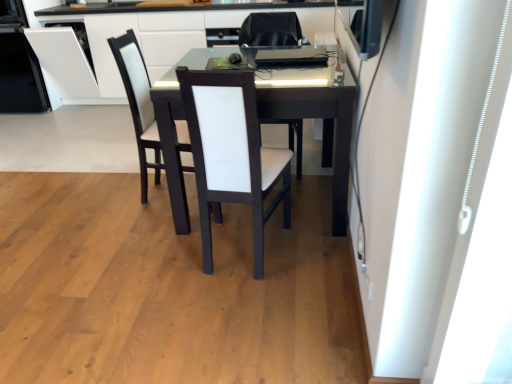
Question: Is white leather chair at center, acting as the second chair starting from the back, positioned far away from white leather chair at center?

Choices:
 (A) no
 (B) yes

Answer: (A)

Question: From the image's perspective, is white leather chair at center, acting as the second chair starting from the back, located above white leather chair at center?

Choices:
 (A) no
 (B) yes

Answer: (A)

Question: Is white leather chair at center, acting as the second chair starting from the back, outside of white leather chair at center?

Choices:
 (A) yes
 (B) no

Answer: (A)

Question: Does white leather chair at center, the first chair in the front-to-back sequence, lie in front of white leather chair at center?

Choices:
 (A) yes
 (B) no

Answer: (A)

Question: Does white leather chair at center, the first chair in the front-to-back sequence, have a lesser width compared to white leather chair at center?

Choices:
 (A) yes
 (B) no

Answer: (B)

Question: From their relative heights in the image, would you say white glossy dishwasher at left is taller or shorter than white leather chair at center, acting as the second chair starting from the back?

Choices:
 (A) short
 (B) tall

Answer: (B)

Question: From the image's perspective, is white glossy dishwasher at left positioned above or below white leather chair at center, the first chair in the front-to-back sequence?

Choices:
 (A) above
 (B) below

Answer: (A)

Question: Is white glossy dishwasher at left bigger or smaller than white leather chair at center, the first chair in the front-to-back sequence?

Choices:
 (A) small
 (B) big

Answer: (B)

Question: In the image, is white glossy dishwasher at left positioned in front of or behind white leather chair at center, acting as the second chair starting from the back?

Choices:
 (A) behind
 (B) front

Answer: (A)

Question: From a real-world perspective, is matte black desk at center positioned above or below white leather chair at center?

Choices:
 (A) above
 (B) below

Answer: (B)

Question: Considering the positions of matte black desk at center and white leather chair at center in the image, is matte black desk at center bigger or smaller than white leather chair at center?

Choices:
 (A) small
 (B) big

Answer: (B)

Question: Considering the positions of matte black desk at center and white leather chair at center in the image, is matte black desk at center wider or thinner than white leather chair at center?

Choices:
 (A) thin
 (B) wide

Answer: (B)

Question: Is point (101, 69) positioned closer to the camera than point (110, 39)?

Choices:
 (A) farther
 (B) closer

Answer: (A)

Question: Is white leather chair at center, acting as the second chair starting from the front, inside or outside of white glossy dishwasher at left?

Choices:
 (A) outside
 (B) inside

Answer: (A)

Question: Does point (125, 66) appear closer or farther from the camera than point (38, 79)?

Choices:
 (A) farther
 (B) closer

Answer: (B)